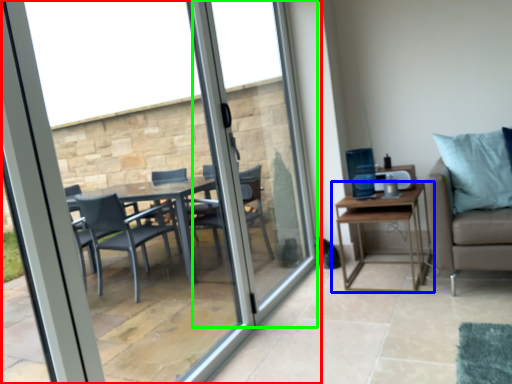
Question: Considering the real-world distances, which object is closest to window (highlighted by a red box)? table (highlighted by a blue box) or screen door (highlighted by a green box).

Choices:
 (A) table
 (B) screen door

Answer: (B)